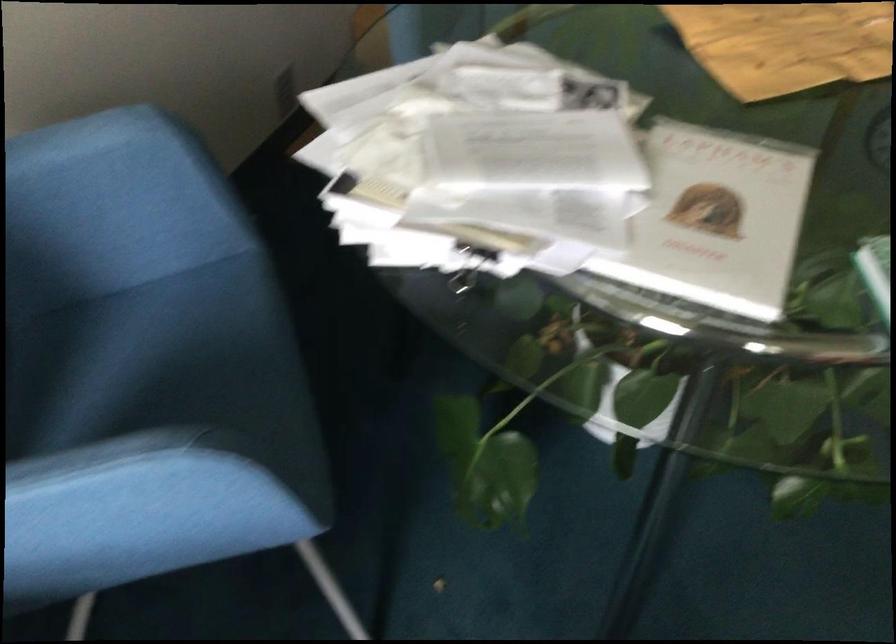
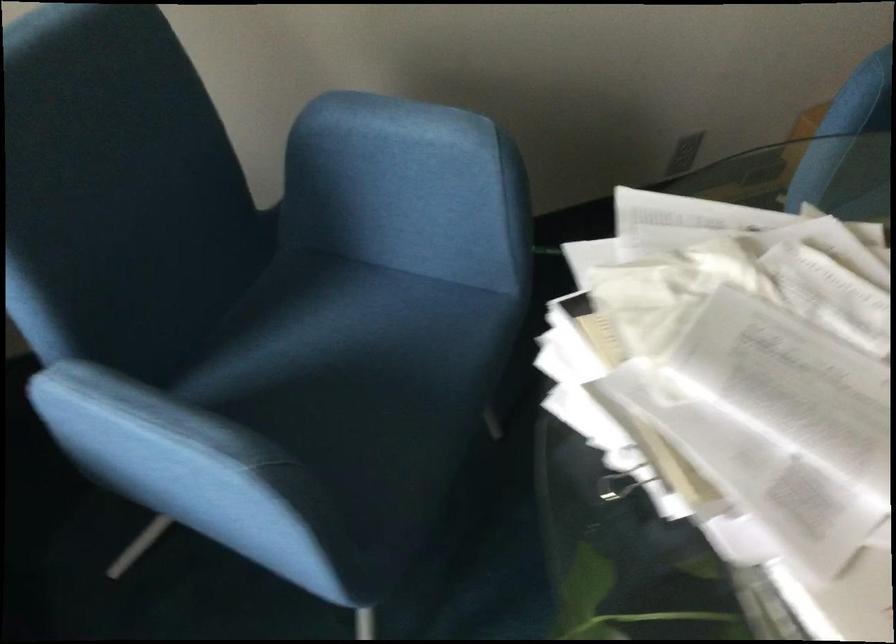
Question: The camera is either moving clockwise (left) or counter-clockwise (right) around the object. The first image is from the beginning of the video and the second image is from the end. Is the camera moving left or right when shooting the video?

Choices:
 (A) Left
 (B) Right

Answer: (B)